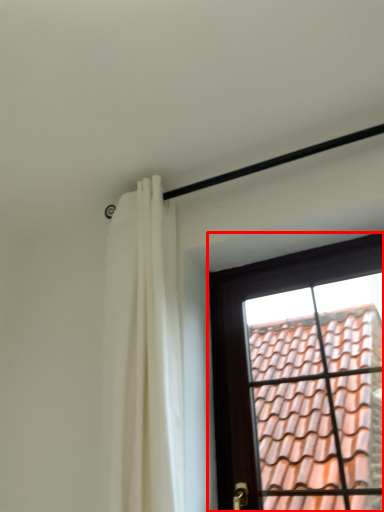
Question: From the image's perspective, considering the relative positions of window (annotated by the red box) and curtain in the image provided, where is window (annotated by the red box) located with respect to the staircase?

Choices:
 (A) above
 (B) below

Answer: (B)